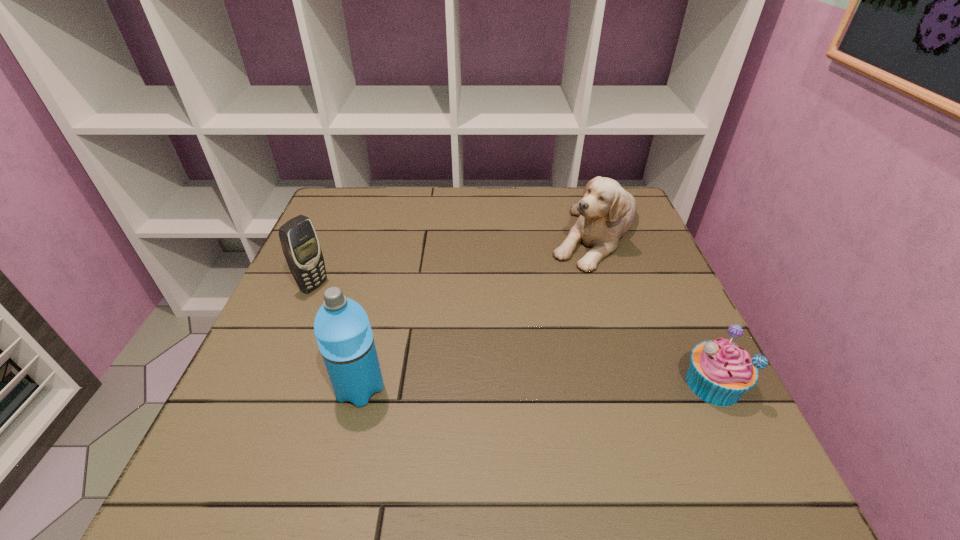
Image resolution: width=960 pixels, height=540 pixels. Find the location of `object that is positioned at the far right corner`. object that is positioned at the far right corner is located at coordinates (606, 211).

Identify the location of object that is at the near right corner. (720, 372).

The image size is (960, 540). In the image, there is a desktop. In order to click on vacant space at the far edge in this screenshot , I will do `click(452, 224)`.

In the image, there is a desktop. At what (x,y) coordinates should I click in order to perform the action: click on free space at the left edge. Please return your answer as a coordinate pair (x, y). The image size is (960, 540). Looking at the image, I should click on (280, 296).

Locate an element on the screen. free spot at the right edge of the desktop is located at coordinates (662, 268).

Identify the location of free region at the far left corner of the desktop. (343, 190).

This screenshot has width=960, height=540. I want to click on free region at the near left corner of the desktop, so (x=271, y=396).

Identify the location of free location at the near right corner of the desktop. (684, 401).

The width and height of the screenshot is (960, 540). In order to click on unoccupied area between the farthest object and the leftmost object in this screenshot , I will do `click(454, 259)`.

Image resolution: width=960 pixels, height=540 pixels. Find the location of `empty space between the puppy and the muffin`. empty space between the puppy and the muffin is located at coordinates (654, 308).